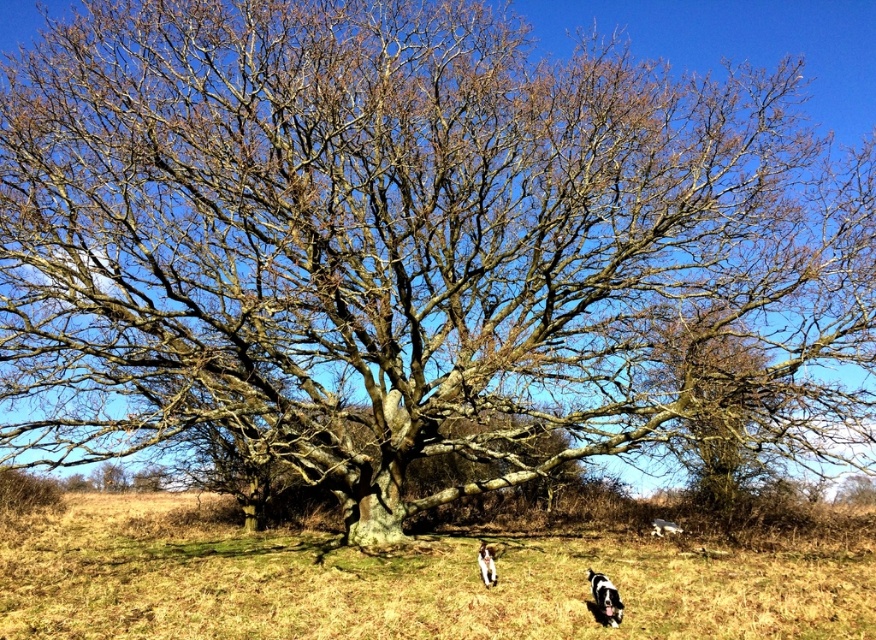
You are standing at the base of the large oak tree in the image. You want to walk to the point marked at coordinates point [401,582]. According to the scene description, what type of terrain will you encounter when you reach that point?

The point [401,582] is on brown grass at center, so you will encounter brown grass terrain when you reach that point.

You are standing at the base of the old oak tree in the image. You want to place a small bench exactly 10 meters away from where you are standing. Is the point at coordinates point (776, 588) far enough to place the bench?

The distance between point (776, 588) and the viewer is 9.55 meters, which is slightly less than the desired 10 meters. Therefore, the point at coordinates point (776, 588) is not far enough to place the bench exactly 10 meters away.

You are a photographer trying to capture a photo of the white fur dog at lower center and the brown grass at center. Which object should you focus on if you want to emphasize the size difference between them?

You should focus on the brown grass at center because it has a larger size compared to the white fur dog at lower center, which will highlight the size contrast between them.